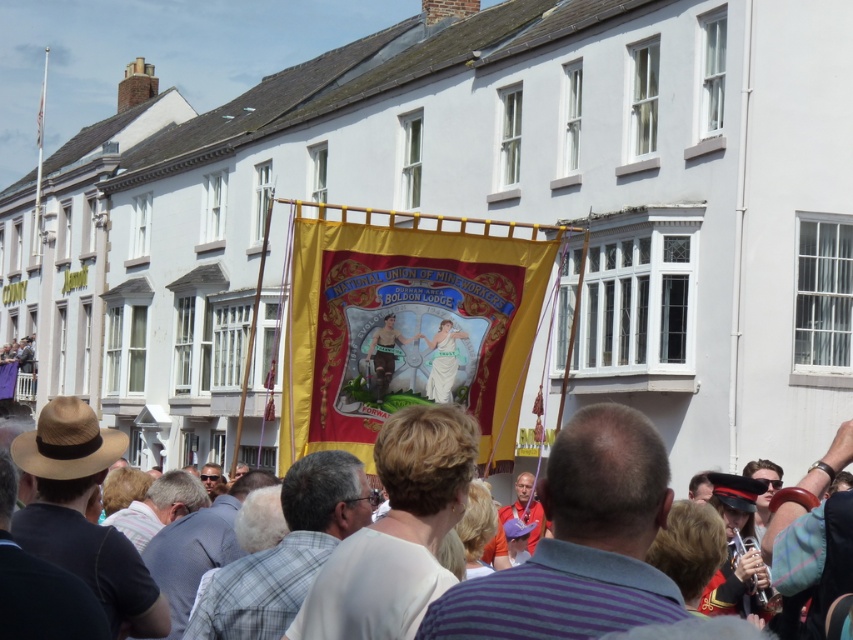
You are a photographer standing at the point marked as point (405, 332). What object is directly in front of you?

The red velvet banner at center is directly in front of you at point (405, 332).

Looking at this image, you are a photographer standing at the edge of the crowd. You want to capture a photo that includes both the white fabric at center and the yellow fabric banner at center. Given their distance apart, do you think you can fit both into your camera frame without moving closer or farther away?

The white fabric at center is 1064.92 feet from the yellow fabric banner at center. This distance is extremely large, so it would be impossible to capture both in a single frame without adjusting your position.